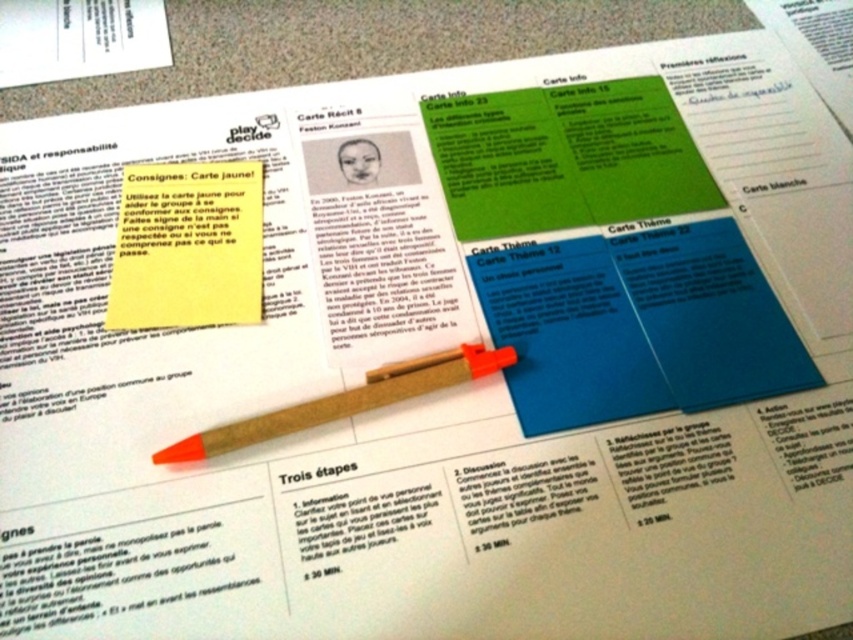
Is point (123, 256) positioned behind point (438, 388)?

That is True.

Is point (132, 225) farther from camera compared to point (448, 353)?

Yes, point (132, 225) is farther from viewer.

The height and width of the screenshot is (640, 853). What are the coordinates of `yellow paper at center` in the screenshot? It's located at (187, 246).